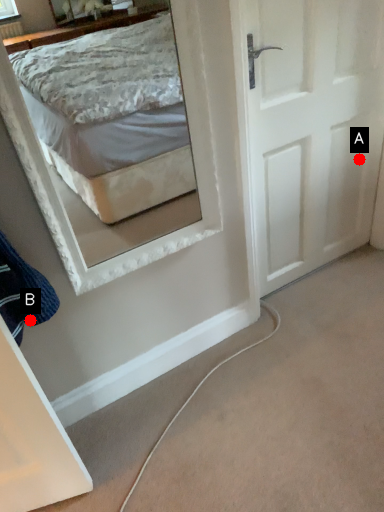
Question: Two points are circled on the image, labeled by A and B beside each circle. Which point is farther to the camera?

Choices:
 (A) A is further
 (B) B is further

Answer: (A)